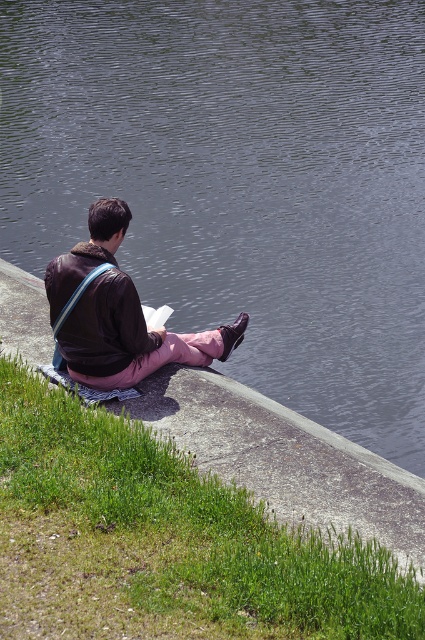
Who is taller, green grass at lower left or matte brown jacket at center?

matte brown jacket at center

Is green grass at lower left wider than matte brown jacket at center?

Indeed, green grass at lower left has a greater width compared to matte brown jacket at center.

Measure the distance between green grass at lower left and camera.

green grass at lower left is 10.44 feet away from camera.

Where is `green grass at lower left`? The image size is (425, 640). green grass at lower left is located at coordinates (166, 540).